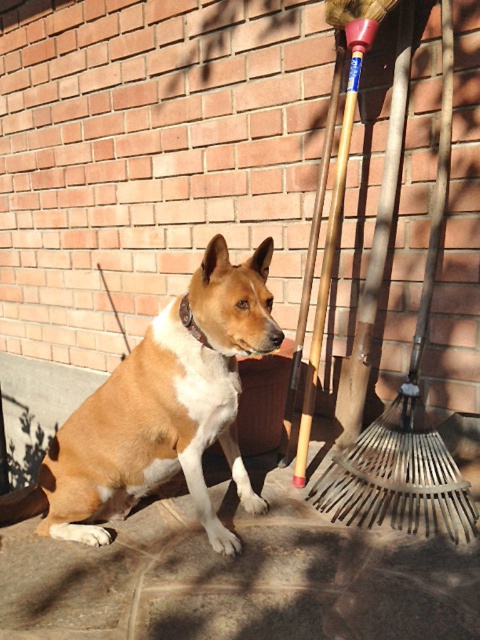
You are standing at the edge of the scene and want to place a small potted plant between the brown stone pavement at lower center and the brown fur dog at center. Based on their positions, where should the potted plant be placed?

The brown stone pavement at lower center is positioned under the brown fur dog at center, so the potted plant should be placed below the brown fur dog at center where the pavement is located.

You are a delivery person trying to determine if the brown fur dog at center can be safely passed by without disturbing it. Considering the size of the wooden shovel at right, which is smaller than the dog, can you estimate if there is enough space to walk around the dog on the right side?

The brown fur dog at center is larger than the wooden shovel at right. Since the shovel is smaller, there might be sufficient space to walk around the dog on the right side, but the exact distance isn

You are standing at the point marked as point (239, 577) in the image. What object are you standing on?

The brown stone pavement at lower center is located at point (239, 577), so you are standing on the brown stone pavement at lower center.